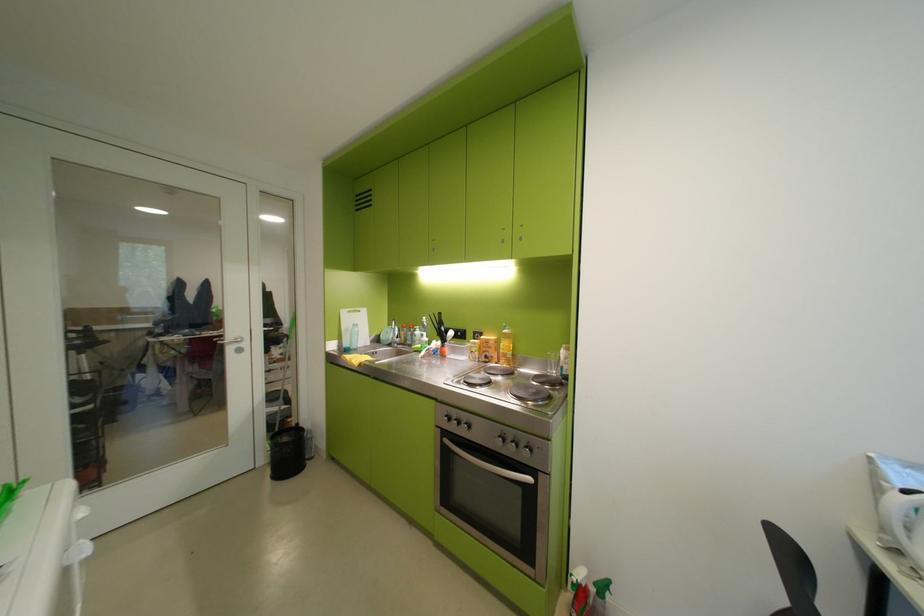
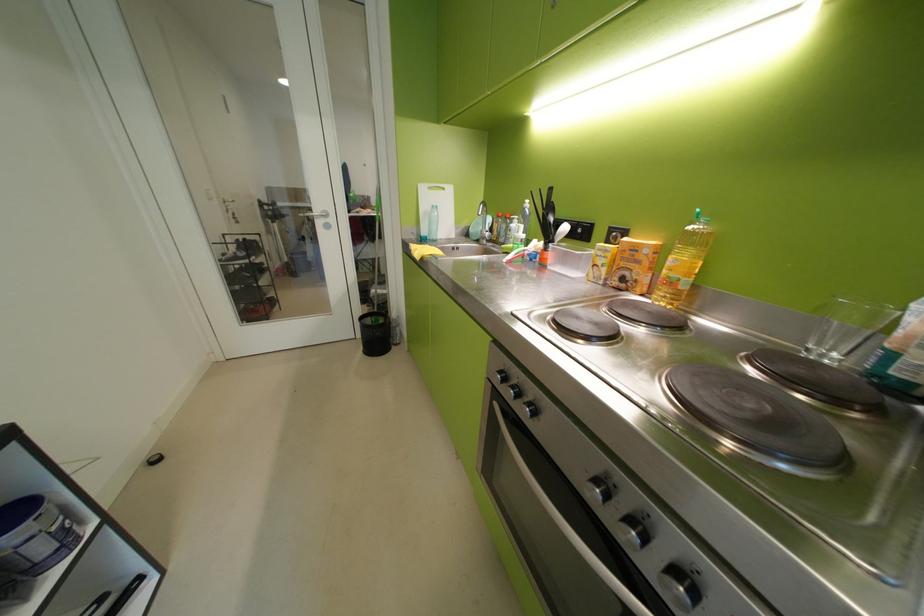
The point at (238, 339) is marked in the first image. Where is the corresponding point in the second image?

(326, 213)